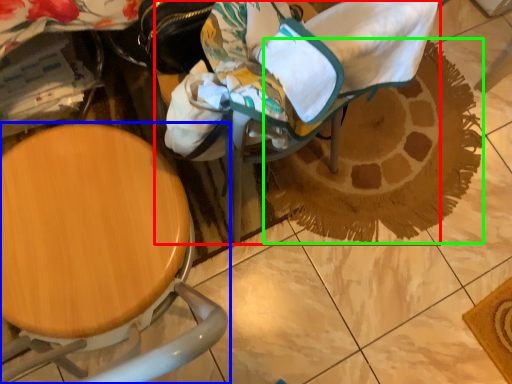
Question: Which is farther away from baby carriage (highlighted by a red box)? chair (highlighted by a blue box) or doormat (highlighted by a green box)?

Choices:
 (A) chair
 (B) doormat

Answer: (B)